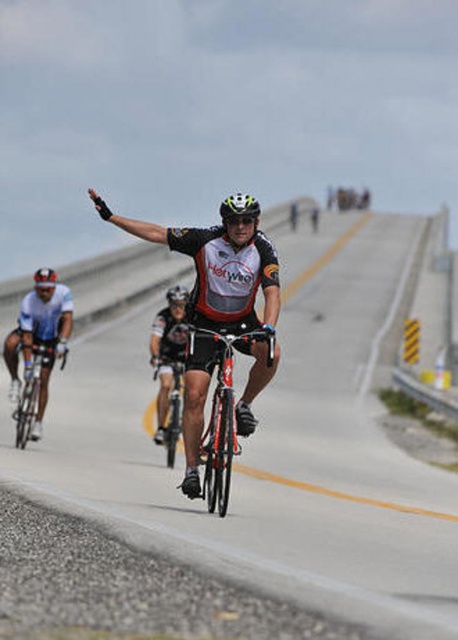
You are a photographer positioned at the side of the road capturing the cyclists. You notice the shiny silver bicycle at center and the black matte bicycle helmet at center. Which object is closer to the left side of your photo?

The shiny silver bicycle at center is closer to the left side of the photo because it is positioned to the left of the black matte bicycle helmet at center.

You are a photographer positioned at point (272, 449). You want to capture a photo of the matte black bicycle at center. Is the bicycle within your current field of view?

The matte black bicycle at center is located at point (272, 449), which is exactly where you are positioned. Therefore, you cannot see the bicycle in your current field of view because you are at the same location as it.